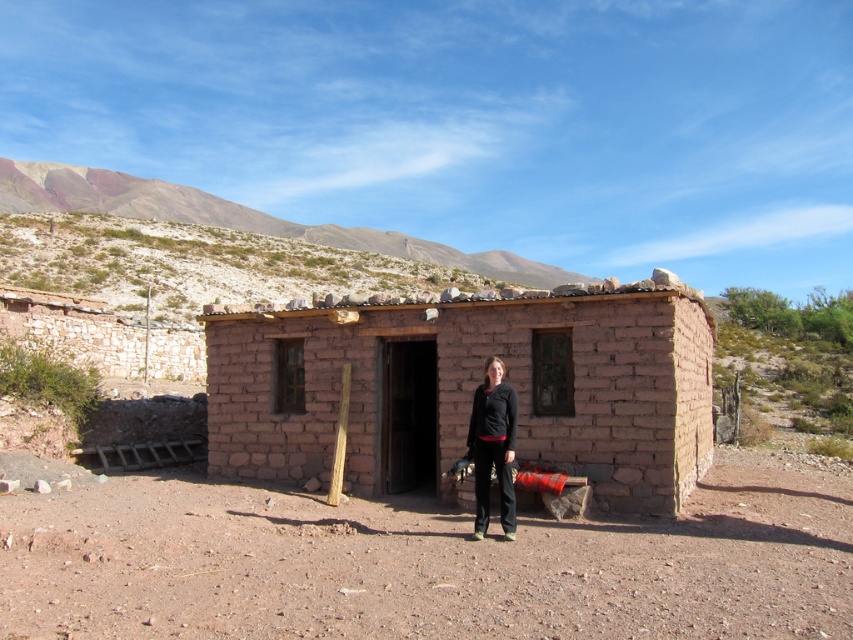
Question: Which of the following is the farthest from the observer?

Choices:
 (A) (490, 456)
 (B) (233, 332)

Answer: (B)

Question: Considering the relative positions of earthy adobe hut at center and black matte pants at center in the image provided, where is earthy adobe hut at center located with respect to black matte pants at center?

Choices:
 (A) right
 (B) left

Answer: (A)

Question: Does earthy adobe hut at center appear under black matte pants at center?

Choices:
 (A) no
 (B) yes

Answer: (A)

Question: Among these points, which one is farthest from the camera?

Choices:
 (A) (503, 374)
 (B) (583, 438)

Answer: (B)

Question: Where is earthy adobe hut at center located in relation to black matte pants at center in the image?

Choices:
 (A) below
 (B) above

Answer: (B)